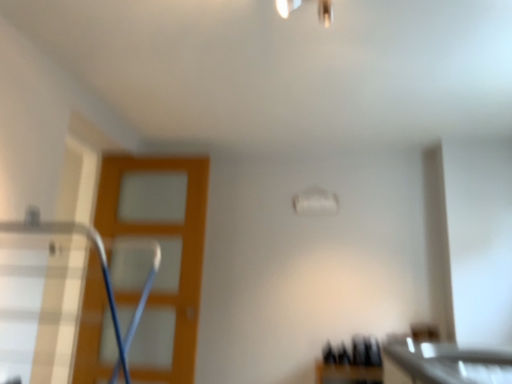
Describe the element at coordinates (444, 363) in the screenshot. I see `white glossy countertop at lower right` at that location.

What do you see at coordinates (162, 253) in the screenshot? The image size is (512, 384). I see `orange wood screen door at left` at bounding box center [162, 253].

Measure the distance between orange wood screen door at left and camera.

The depth of orange wood screen door at left is 2.43 meters.

Find the location of a particular element. The image size is (512, 384). metallic silver swivel chair at left is located at coordinates (101, 267).

I want to click on white glossy countertop at lower right, so click(x=444, y=363).

From the image's perspective, between metallic silver swivel chair at left and white glossy countertop at lower right, who is located below?

From the image's view, white glossy countertop at lower right is below.

The image size is (512, 384). What are the coordinates of `counter top that appears on the right of metallic silver swivel chair at left` in the screenshot? It's located at (444, 363).

Looking at this image, is metallic silver swivel chair at left placed right next to white glossy countertop at lower right?

metallic silver swivel chair at left is not next to white glossy countertop at lower right, and they're not touching.

From a real-world perspective, which is physically below, white glossy countertop at lower right or metallic silver swivel chair at left?

white glossy countertop at lower right is physically lower.

Could you tell me if white glossy countertop at lower right is turned towards metallic silver swivel chair at left?

Yes, white glossy countertop at lower right faces towards metallic silver swivel chair at left.

Considering the sizes of white glossy countertop at lower right and metallic silver swivel chair at left in the image, is white glossy countertop at lower right wider or thinner than metallic silver swivel chair at left?

Clearly, white glossy countertop at lower right has less width compared to metallic silver swivel chair at left.

Consider the image. How many degrees apart are the facing directions of white glossy countertop at lower right and metallic silver swivel chair at left?

180 degrees.

Based on the photo, is orange wood screen door at left in front of or behind white glossy countertop at lower right in the image?

In the image, orange wood screen door at left appears behind white glossy countertop at lower right.

Considering the sizes of orange wood screen door at left and white glossy countertop at lower right in the image, is orange wood screen door at left taller or shorter than white glossy countertop at lower right?

orange wood screen door at left is taller than white glossy countertop at lower right.

Is there a large distance between orange wood screen door at left and white glossy countertop at lower right?

Indeed, orange wood screen door at left is not near white glossy countertop at lower right.

How different are the orientations of metallic silver swivel chair at left and orange wood screen door at left in degrees?

The angle between the facing direction of metallic silver swivel chair at left and the facing direction of orange wood screen door at left is 90.1 degrees.

Between metallic silver swivel chair at left and orange wood screen door at left, which one has more height?

orange wood screen door at left is taller.

Is metallic silver swivel chair at left to the right of orange wood screen door at left from the viewer's perspective?

Indeed, metallic silver swivel chair at left is positioned on the right side of orange wood screen door at left.

Is orange wood screen door at left positioned beyond the bounds of metallic silver swivel chair at left?

Yes, orange wood screen door at left is located beyond the bounds of metallic silver swivel chair at left.

Considering the sizes of orange wood screen door at left and metallic silver swivel chair at left in the image, is orange wood screen door at left wider or thinner than metallic silver swivel chair at left?

In the image, orange wood screen door at left appears to be more narrow than metallic silver swivel chair at left.

Is orange wood screen door at left touching metallic silver swivel chair at left?

orange wood screen door at left and metallic silver swivel chair at left are clearly separated.

From a real-world perspective, is white glossy countertop at lower right on top of orange wood screen door at left?

No, from a real-world perspective, white glossy countertop at lower right is not over orange wood screen door at left

What's the angular difference between white glossy countertop at lower right and orange wood screen door at left's facing directions?

89.4 degrees.

Where is `counter top lying on the right of orange wood screen door at left`? This screenshot has width=512, height=384. counter top lying on the right of orange wood screen door at left is located at coordinates (444, 363).

Consider the image. Is white glossy countertop at lower right not near orange wood screen door at left?

Yes, white glossy countertop at lower right and orange wood screen door at left are located far from each other.

The image size is (512, 384). I want to click on swivel chair above the white glossy countertop at lower right (from the image's perspective), so (x=101, y=267).

This screenshot has width=512, height=384. What are the coordinates of `counter top lying below the metallic silver swivel chair at left (from the image's perspective)` in the screenshot? It's located at (444, 363).

From the image, which object appears to be nearer to orange wood screen door at left, white glossy countertop at lower right or metallic silver swivel chair at left?

metallic silver swivel chair at left lies closer to orange wood screen door at left than the other object.

When comparing their distances from metallic silver swivel chair at left, does orange wood screen door at left or white glossy countertop at lower right seem further?

Based on the image, white glossy countertop at lower right appears to be further to metallic silver swivel chair at left.

When comparing their distances from white glossy countertop at lower right, does orange wood screen door at left or metallic silver swivel chair at left seem closer?

The object closer to white glossy countertop at lower right is orange wood screen door at left.

Consider the image. Which object lies further to the anchor point metallic silver swivel chair at left, white glossy countertop at lower right or orange wood screen door at left?

Among the two, white glossy countertop at lower right is located further to metallic silver swivel chair at left.

Which object lies further to the anchor point orange wood screen door at left, metallic silver swivel chair at left or white glossy countertop at lower right?

Based on the image, white glossy countertop at lower right appears to be further to orange wood screen door at left.

Looking at the image, which one is located further to white glossy countertop at lower right, metallic silver swivel chair at left or orange wood screen door at left?

metallic silver swivel chair at left is further to white glossy countertop at lower right.

Where is `counter top between metallic silver swivel chair at left and orange wood screen door at left in the front-back direction`? The image size is (512, 384). counter top between metallic silver swivel chair at left and orange wood screen door at left in the front-back direction is located at coordinates (444, 363).